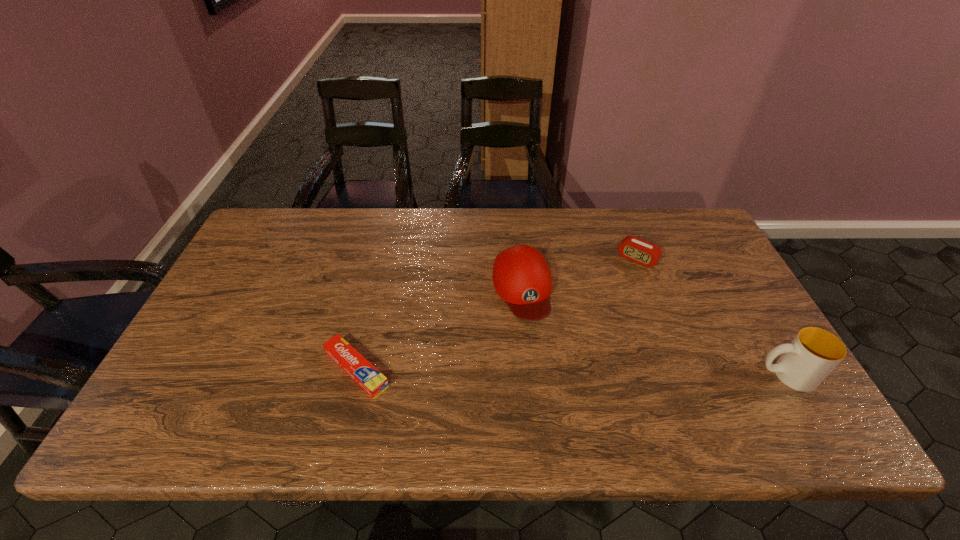
Identify the location of object located in the near right corner section of the desktop. This screenshot has width=960, height=540. (813, 354).

The image size is (960, 540). I want to click on free location at the far edge, so click(584, 231).

Where is `free region at the left edge`? This screenshot has height=540, width=960. free region at the left edge is located at coordinates (205, 340).

Find the location of a particular element. This screenshot has height=540, width=960. vacant area at the right edge is located at coordinates (667, 256).

This screenshot has width=960, height=540. In the image, there is a desktop. Identify the location of vacant space at the far left corner. (264, 244).

The width and height of the screenshot is (960, 540). In the image, there is a desktop. Identify the location of free space at the far right corner. (684, 247).

The height and width of the screenshot is (540, 960). In the image, there is a desktop. What are the coordinates of `vacant space at the near right corner` in the screenshot? It's located at (780, 388).

I want to click on free space between the third object from right to left and the second object from right to left, so click(580, 273).

I want to click on blank region between the shortest object and the cup, so click(571, 372).

Locate an element on the screen. The height and width of the screenshot is (540, 960). vacant space that is in between the rightmost object and the baseball cap is located at coordinates (654, 332).